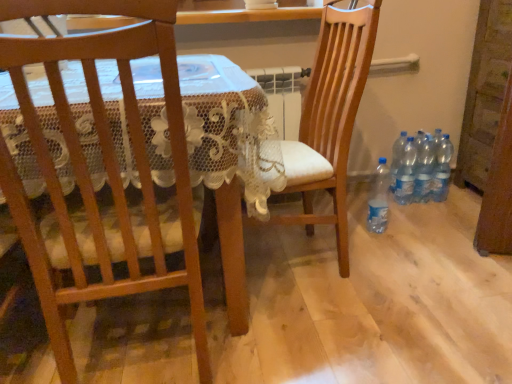
Where is `free region on the left part of clear plastic bottle at lower right, which appears as the 1th bottle when viewed from the left`? This screenshot has height=384, width=512. free region on the left part of clear plastic bottle at lower right, which appears as the 1th bottle when viewed from the left is located at coordinates (332, 232).